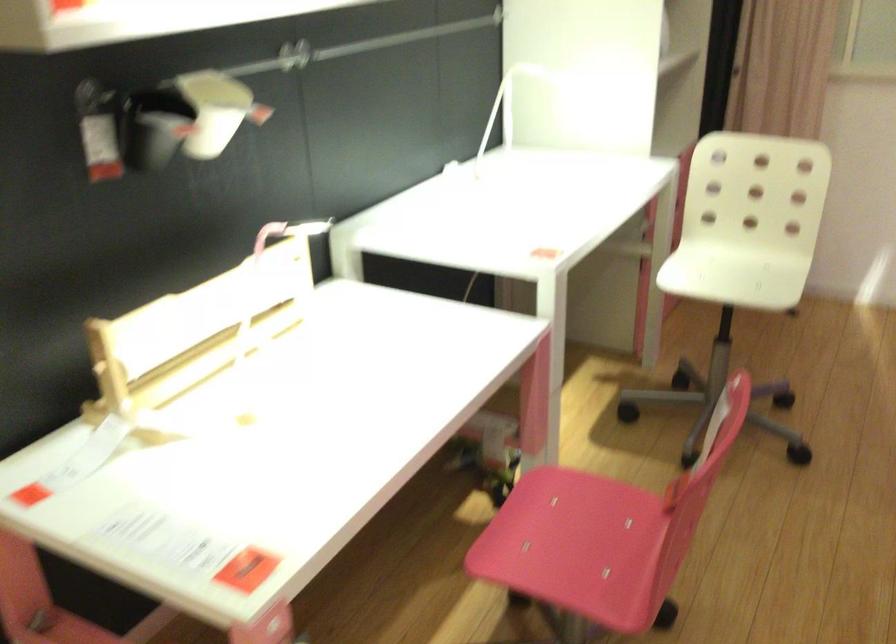
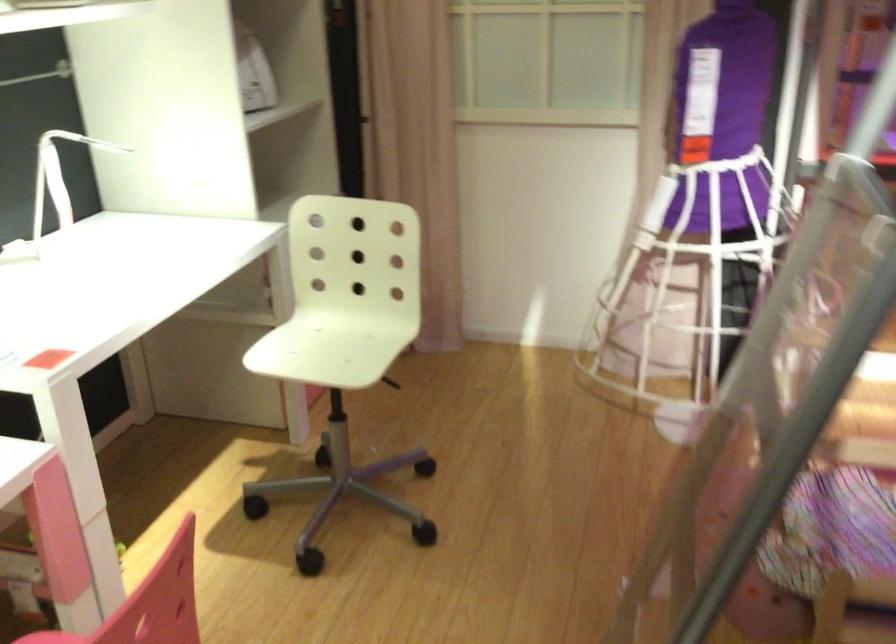
The point at (x=503, y=109) is marked in the first image. Where is the corresponding point in the second image?

(58, 176)